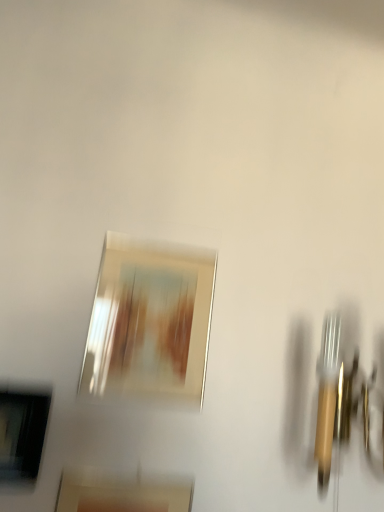
What do you see at coordinates (149, 321) in the screenshot? This screenshot has height=512, width=384. I see `metallic silver picture frame at center, which is counted as the 3th picture frame, starting from the bottom` at bounding box center [149, 321].

Locate an element on the screen. The height and width of the screenshot is (512, 384). matte black picture frame at lower left, marked as the second picture frame in a top-to-bottom arrangement is located at coordinates (22, 434).

Are matte gold picture frame at center, positioned as the 1th picture frame in bottom-to-top order, and metallic silver picture frame at center, which is counted as the 3th picture frame, starting from the bottom, beside each other?

They are not placed beside each other.

Which object is further away from the camera, matte gold picture frame at center, which is counted as the 3th picture frame, starting from the top, or metallic silver picture frame at center, which is counted as the 3th picture frame, starting from the bottom?

metallic silver picture frame at center, which is counted as the 3th picture frame, starting from the bottom.

How many degrees apart are the facing directions of matte gold picture frame at center, positioned as the 1th picture frame in bottom-to-top order, and metallic silver picture frame at center, the 1th picture frame in the top-to-bottom sequence?

matte gold picture frame at center, positioned as the 1th picture frame in bottom-to-top order, and metallic silver picture frame at center, the 1th picture frame in the top-to-bottom sequence, are facing 0.00048 degrees away from each other.

Which of these two, matte gold picture frame at center, positioned as the 1th picture frame in bottom-to-top order, or metallic silver picture frame at center, the 1th picture frame in the top-to-bottom sequence, stands shorter?

Standing shorter between the two is metallic silver picture frame at center, the 1th picture frame in the top-to-bottom sequence.

From the image's perspective, between metallic silver picture frame at center, the 1th picture frame in the top-to-bottom sequence, and matte black picture frame at lower left, the 2th picture frame positioned from the bottom, who is located below?

matte black picture frame at lower left, the 2th picture frame positioned from the bottom.

From a real-world perspective, is metallic silver picture frame at center, which is counted as the 3th picture frame, starting from the bottom, physically located above or below matte black picture frame at lower left, the 2th picture frame positioned from the bottom?

From a real-world perspective, metallic silver picture frame at center, which is counted as the 3th picture frame, starting from the bottom, is physically above matte black picture frame at lower left, the 2th picture frame positioned from the bottom.

Are metallic silver picture frame at center, which is counted as the 3th picture frame, starting from the bottom, and matte black picture frame at lower left, the 2th picture frame positioned from the bottom, located far from each other?

No.

In terms of width, does metallic silver picture frame at center, the 1th picture frame in the top-to-bottom sequence, look wider or thinner when compared to matte gold picture frame at center, which is counted as the 3th picture frame, starting from the top?

In the image, metallic silver picture frame at center, the 1th picture frame in the top-to-bottom sequence, appears to be more narrow than matte gold picture frame at center, which is counted as the 3th picture frame, starting from the top.

Is point (99, 306) less distant than point (185, 502)?

No, it is behind (185, 502).

Does metallic silver picture frame at center, which is counted as the 3th picture frame, starting from the bottom, have a greater height compared to matte gold picture frame at center, positioned as the 1th picture frame in bottom-to-top order?

→ Incorrect, the height of metallic silver picture frame at center, which is counted as the 3th picture frame, starting from the bottom, is not larger of that of matte gold picture frame at center, positioned as the 1th picture frame in bottom-to-top order.

From the image's perspective, is metallic silver picture frame at center, which is counted as the 3th picture frame, starting from the bottom, beneath matte gold picture frame at center, which is counted as the 3th picture frame, starting from the top?

Incorrect, from the image's perspective, metallic silver picture frame at center, which is counted as the 3th picture frame, starting from the bottom, is higher than matte gold picture frame at center, which is counted as the 3th picture frame, starting from the top.

Which is in front, point (33, 472) or point (103, 476)?

Positioned in front is point (33, 472).

Looking at this image, from a real-world perspective, is matte black picture frame at lower left, marked as the second picture frame in a top-to-bottom arrangement, physically above matte gold picture frame at center, which is counted as the 3th picture frame, starting from the top?

Yes, from a real-world perspective, matte black picture frame at lower left, marked as the second picture frame in a top-to-bottom arrangement, is on top of matte gold picture frame at center, which is counted as the 3th picture frame, starting from the top.

Where is `the 1st picture frame to the right of the matte black picture frame at lower left, marked as the second picture frame in a top-to-bottom arrangement, counting from the anchor's position`? The image size is (384, 512). the 1st picture frame to the right of the matte black picture frame at lower left, marked as the second picture frame in a top-to-bottom arrangement, counting from the anchor's position is located at coordinates (122, 493).

What's the angular difference between matte black picture frame at lower left, the 2th picture frame positioned from the bottom, and metallic silver picture frame at center, which is counted as the 3th picture frame, starting from the bottom,'s facing directions?

matte black picture frame at lower left, the 2th picture frame positioned from the bottom, and metallic silver picture frame at center, which is counted as the 3th picture frame, starting from the bottom, are facing 0.000554 degrees away from each other.

Based on the photo, from their relative heights in the image, would you say matte black picture frame at lower left, marked as the second picture frame in a top-to-bottom arrangement, is taller or shorter than metallic silver picture frame at center, which is counted as the 3th picture frame, starting from the bottom?

Considering their sizes, matte black picture frame at lower left, marked as the second picture frame in a top-to-bottom arrangement, has less height than metallic silver picture frame at center, which is counted as the 3th picture frame, starting from the bottom.

Are matte black picture frame at lower left, the 2th picture frame positioned from the bottom, and metallic silver picture frame at center, the 1th picture frame in the top-to-bottom sequence, far apart?

Actually, matte black picture frame at lower left, the 2th picture frame positioned from the bottom, and metallic silver picture frame at center, the 1th picture frame in the top-to-bottom sequence, are a little close together.

Is matte gold picture frame at center, positioned as the 1th picture frame in bottom-to-top order, positioned beyond the bounds of matte black picture frame at lower left, marked as the second picture frame in a top-to-bottom arrangement?

Absolutely, matte gold picture frame at center, positioned as the 1th picture frame in bottom-to-top order, is external to matte black picture frame at lower left, marked as the second picture frame in a top-to-bottom arrangement.

Are matte gold picture frame at center, which is counted as the 3th picture frame, starting from the top, and matte black picture frame at lower left, marked as the second picture frame in a top-to-bottom arrangement, far apart?

No, matte gold picture frame at center, which is counted as the 3th picture frame, starting from the top, is not far away from matte black picture frame at lower left, marked as the second picture frame in a top-to-bottom arrangement.

Between matte gold picture frame at center, which is counted as the 3th picture frame, starting from the top, and matte black picture frame at lower left, the 2th picture frame positioned from the bottom, which one has smaller width?

matte gold picture frame at center, which is counted as the 3th picture frame, starting from the top, is thinner.

Considering the relative sizes of matte gold picture frame at center, which is counted as the 3th picture frame, starting from the top, and matte black picture frame at lower left, the 2th picture frame positioned from the bottom, in the image provided, is matte gold picture frame at center, which is counted as the 3th picture frame, starting from the top, shorter than matte black picture frame at lower left, the 2th picture frame positioned from the bottom,?

Incorrect, the height of matte gold picture frame at center, which is counted as the 3th picture frame, starting from the top, does not fall short of that of matte black picture frame at lower left, the 2th picture frame positioned from the bottom.

At what (x,y) coordinates should I click in order to perform the action: click on the 2nd picture frame behind the matte gold picture frame at center, which is counted as the 3th picture frame, starting from the top. Please return your answer as a coordinate pair (x, y). The height and width of the screenshot is (512, 384). Looking at the image, I should click on (149, 321).

This screenshot has height=512, width=384. I want to click on picture frame that is the 1st one when counting downward from the metallic silver picture frame at center, the 1th picture frame in the top-to-bottom sequence (from the image's perspective), so click(22, 434).

Based on their spatial positions, is metallic silver picture frame at center, which is counted as the 3th picture frame, starting from the bottom, or matte gold picture frame at center, which is counted as the 3th picture frame, starting from the top, closer to matte black picture frame at lower left, the 2th picture frame positioned from the bottom?

matte gold picture frame at center, which is counted as the 3th picture frame, starting from the top.

When comparing their distances from matte gold picture frame at center, which is counted as the 3th picture frame, starting from the top, does matte black picture frame at lower left, marked as the second picture frame in a top-to-bottom arrangement, or metallic silver picture frame at center, the 1th picture frame in the top-to-bottom sequence, seem further?

metallic silver picture frame at center, the 1th picture frame in the top-to-bottom sequence, lies further to matte gold picture frame at center, which is counted as the 3th picture frame, starting from the top, than the other object.

From the image, which object appears to be farther from matte black picture frame at lower left, marked as the second picture frame in a top-to-bottom arrangement, matte gold picture frame at center, positioned as the 1th picture frame in bottom-to-top order, or metallic silver picture frame at center, which is counted as the 3th picture frame, starting from the bottom?

metallic silver picture frame at center, which is counted as the 3th picture frame, starting from the bottom.

From the image, which object appears to be nearer to metallic silver picture frame at center, the 1th picture frame in the top-to-bottom sequence, matte black picture frame at lower left, marked as the second picture frame in a top-to-bottom arrangement, or matte gold picture frame at center, which is counted as the 3th picture frame, starting from the top?

matte black picture frame at lower left, marked as the second picture frame in a top-to-bottom arrangement, is positioned closer to the anchor metallic silver picture frame at center, the 1th picture frame in the top-to-bottom sequence.

Based on their spatial positions, is matte gold picture frame at center, positioned as the 1th picture frame in bottom-to-top order, or matte black picture frame at lower left, the 2th picture frame positioned from the bottom, further from metallic silver picture frame at center, which is counted as the 3th picture frame, starting from the bottom?

matte gold picture frame at center, positioned as the 1th picture frame in bottom-to-top order, is further to metallic silver picture frame at center, which is counted as the 3th picture frame, starting from the bottom.

Looking at the image, which one is located further to matte gold picture frame at center, positioned as the 1th picture frame in bottom-to-top order, metallic silver picture frame at center, which is counted as the 3th picture frame, starting from the bottom, or matte black picture frame at lower left, the 2th picture frame positioned from the bottom?

metallic silver picture frame at center, which is counted as the 3th picture frame, starting from the bottom, lies further to matte gold picture frame at center, positioned as the 1th picture frame in bottom-to-top order, than the other object.

This screenshot has height=512, width=384. Identify the location of picture frame between metallic silver picture frame at center, which is counted as the 3th picture frame, starting from the bottom, and matte gold picture frame at center, positioned as the 1th picture frame in bottom-to-top order, in the vertical direction. (22, 434).